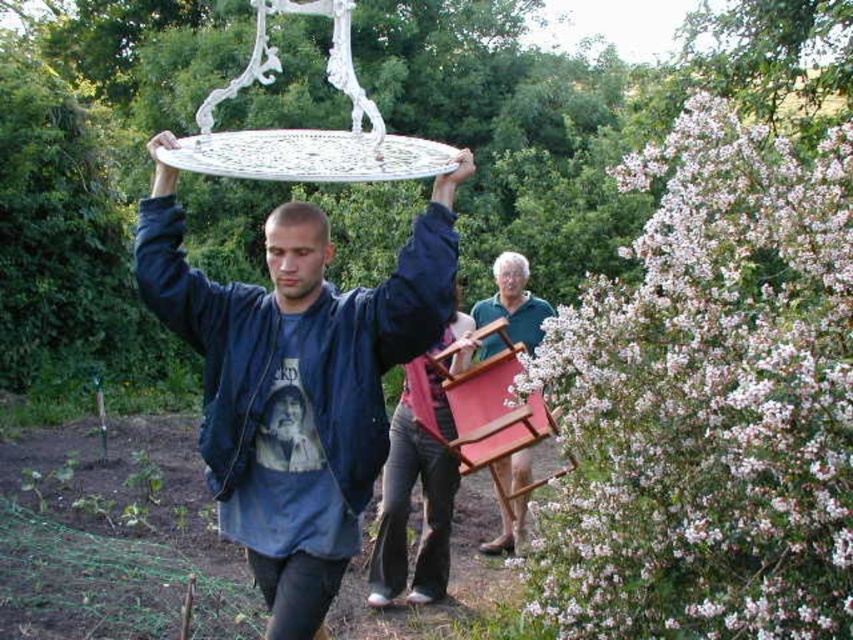
Can you confirm if matte black t-shirt at center is positioned to the left of gray hair at upper center?

Yes, matte black t-shirt at center is to the left of gray hair at upper center.

How distant is matte black t-shirt at center from gray hair at upper center?

They are 17.50 feet apart.

Who is more forward, (267, 406) or (511, 298)?

Point (267, 406) is more forward.

The image size is (853, 640). In order to click on matte black t-shirt at center in this screenshot , I will do `click(285, 420)`.

Which is more to the left, matte white plate at center or matte black t-shirt at center?

matte black t-shirt at center is more to the left.

Which of these two, matte white plate at center or matte black t-shirt at center, stands shorter?

Standing shorter between the two is matte black t-shirt at center.

Who is more forward, (234,413) or (273,416)?

Point (234,413) is in front.

Identify the location of matte white plate at center. (302, 388).

Which of these two, teal fabric shirt at center or matte black head at center, stands taller?

Standing taller between the two is teal fabric shirt at center.

Is point (514, 465) positioned after point (462, 296)?

No, it is in front of (462, 296).

Which is behind, point (512, 282) or point (457, 273)?

The point (457, 273) is behind.

Locate an element on the screen. This screenshot has width=853, height=640. teal fabric shirt at center is located at coordinates coord(514,301).